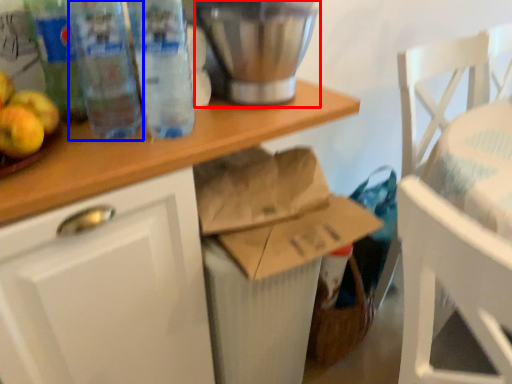
Question: Which object is closer to the camera taking this photo, appliance (highlighted by a red box) or bottle (highlighted by a blue box)?

Choices:
 (A) appliance
 (B) bottle

Answer: (B)